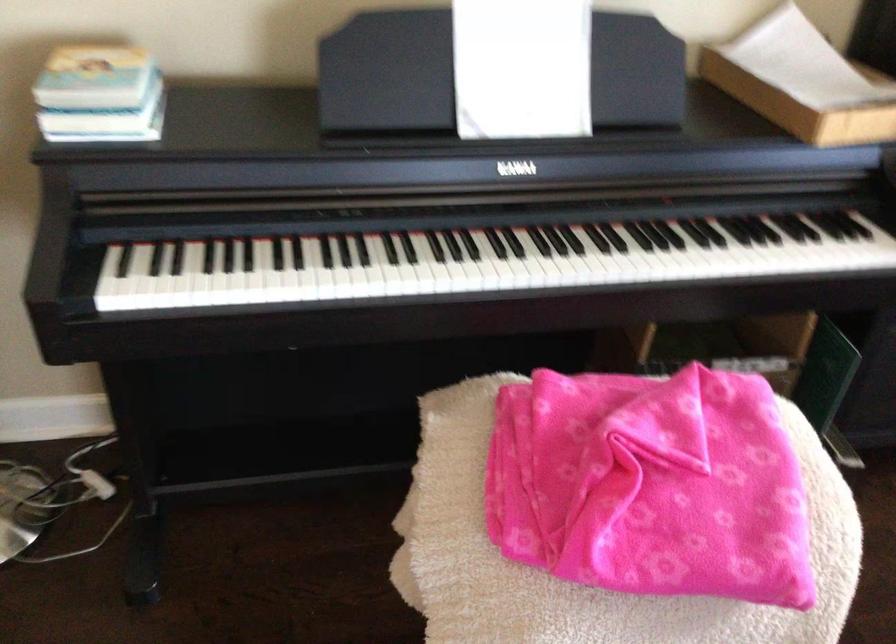
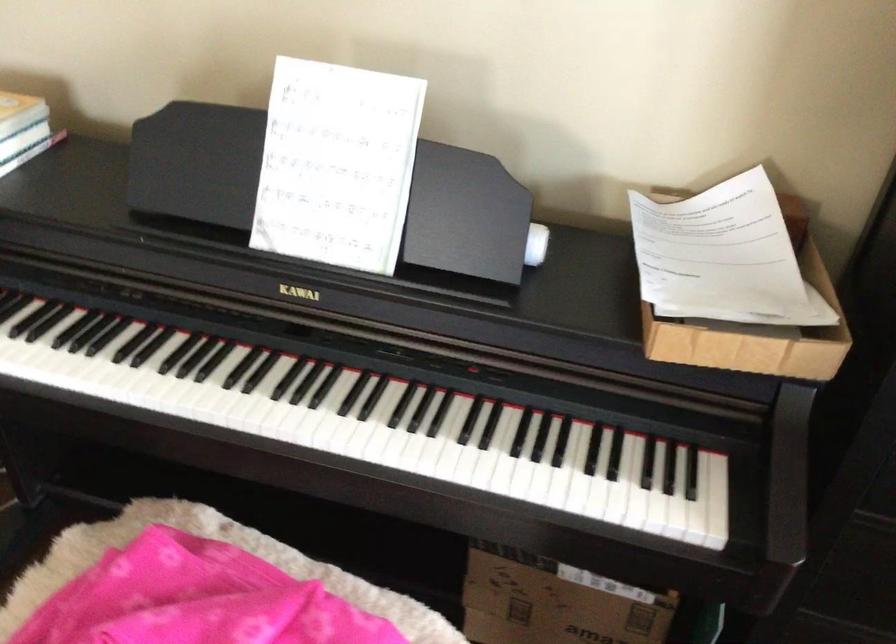
In the second image, find the point that corresponds to [153,84] in the first image.

(23, 129)